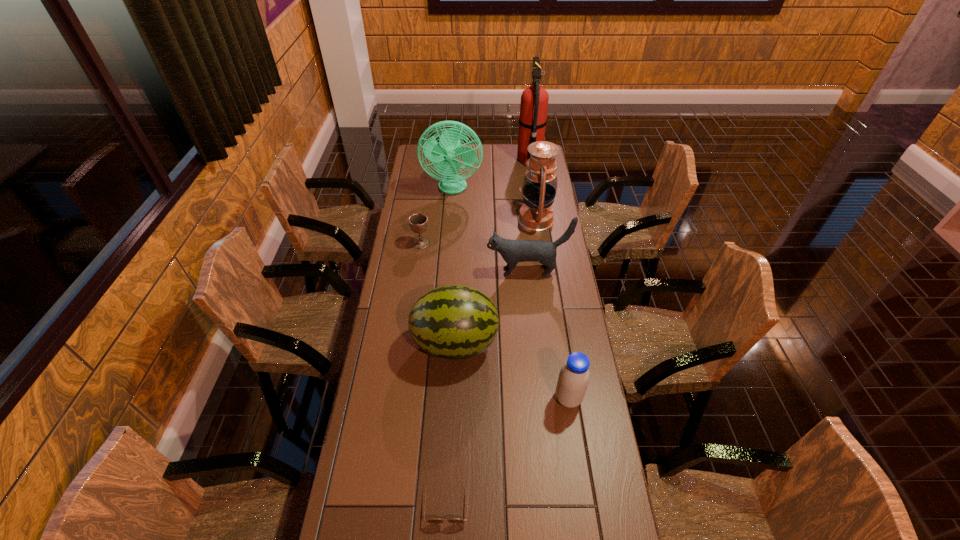
The image size is (960, 540). In order to click on free point located 0.400m on the back of the second nearest object in this screenshot , I will do `click(552, 295)`.

I want to click on free space located 0.190m on the front of the second shortest object, so click(x=416, y=281).

Where is `object that is at the far edge`? object that is at the far edge is located at coordinates 534,100.

You are a GUI agent. You are given a task and a screenshot of the screen. Output one action in this format:
    pyautogui.click(x=<x>, y=<y>)
    Task: Click on the fan present at the left edge
    The image size is (960, 540).
    Given the screenshot: What is the action you would take?
    pyautogui.click(x=441, y=154)

Locate an element on the screen. This screenshot has width=960, height=540. watermelon situated at the left edge is located at coordinates (454, 322).

Image resolution: width=960 pixels, height=540 pixels. I want to click on chalice that is at the left edge, so click(418, 222).

I want to click on fire extinguisher located in the right edge section of the desktop, so pyautogui.click(x=534, y=100).

At what (x,y) coordinates should I click in order to perform the action: click on oil lamp that is at the right edge. Please return your answer as a coordinate pair (x, y). Looking at the image, I should click on (539, 188).

Identify the location of cat that is at the right edge. (512, 251).

The width and height of the screenshot is (960, 540). What are the coordinates of `soya milk positioned at the right edge` in the screenshot? It's located at (573, 380).